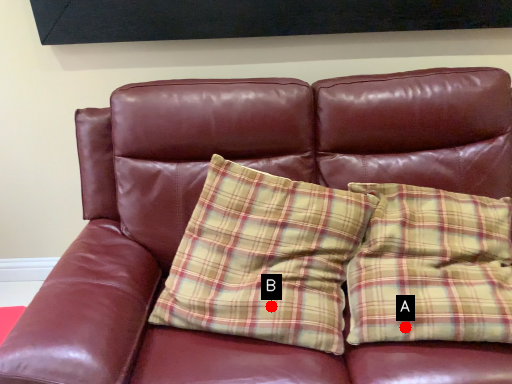
Question: Two points are circled on the image, labeled by A and B beside each circle. Among these points, which one is farthest from the camera?

Choices:
 (A) A is further
 (B) B is further

Answer: (B)